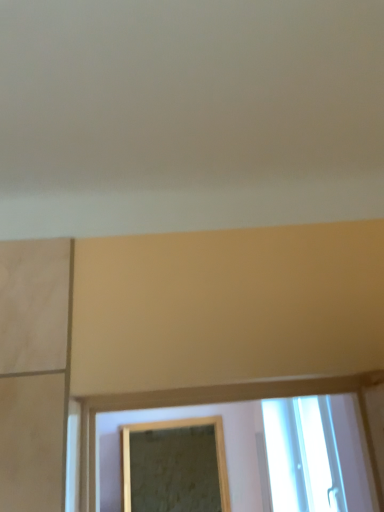
Question: Is gold-framed mirror at center to the right of transparent glass window at lower right from the viewer's perspective?

Choices:
 (A) yes
 (B) no

Answer: (B)

Question: Does gold-framed mirror at center have a greater height compared to transparent glass window at lower right?

Choices:
 (A) no
 (B) yes

Answer: (B)

Question: Can you confirm if gold-framed mirror at center is thinner than transparent glass window at lower right?

Choices:
 (A) no
 (B) yes

Answer: (A)

Question: Is gold-framed mirror at center positioned behind transparent glass window at lower right?

Choices:
 (A) yes
 (B) no

Answer: (A)

Question: Is gold-framed mirror at center smaller than transparent glass window at lower right?

Choices:
 (A) yes
 (B) no

Answer: (B)

Question: Is gold-framed mirror at center facing away from transparent glass window at lower right?

Choices:
 (A) no
 (B) yes

Answer: (A)

Question: From a real-world perspective, is transparent glass window at lower right on top of gold-framed mirror at center?

Choices:
 (A) yes
 (B) no

Answer: (A)

Question: Can you confirm if transparent glass window at lower right is wider than gold-framed mirror at center?

Choices:
 (A) no
 (B) yes

Answer: (A)

Question: Considering the relative positions of transparent glass window at lower right and gold-framed mirror at center in the image provided, is transparent glass window at lower right behind gold-framed mirror at center?

Choices:
 (A) no
 (B) yes

Answer: (A)

Question: Could gold-framed mirror at center be considered to be inside transparent glass window at lower right?

Choices:
 (A) yes
 (B) no

Answer: (B)

Question: Can we say transparent glass window at lower right lies outside gold-framed mirror at center?

Choices:
 (A) yes
 (B) no

Answer: (A)

Question: Is transparent glass window at lower right beside gold-framed mirror at center?

Choices:
 (A) yes
 (B) no

Answer: (B)

Question: In the image, is gold-framed mirror at center on the left side or the right side of transparent glass window at lower right?

Choices:
 (A) right
 (B) left

Answer: (B)